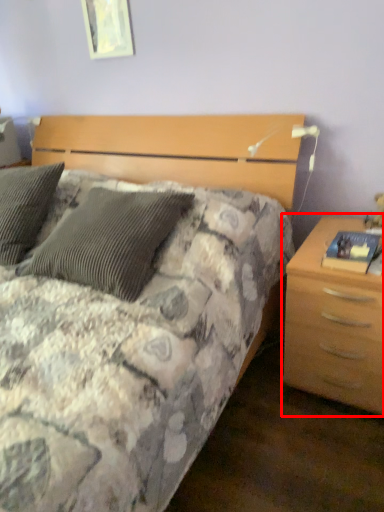
Question: From the image's perspective, considering the relative positions of nightstand (annotated by the red box) and picture frame in the image provided, where is nightstand (annotated by the red box) located with respect to the staircase?

Choices:
 (A) below
 (B) above

Answer: (A)